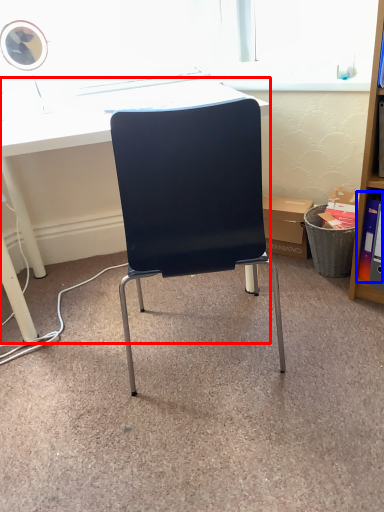
Question: Which object appears farthest to the camera in this image, desk (highlighted by a red box) or book (highlighted by a blue box)?

Choices:
 (A) desk
 (B) book

Answer: (B)